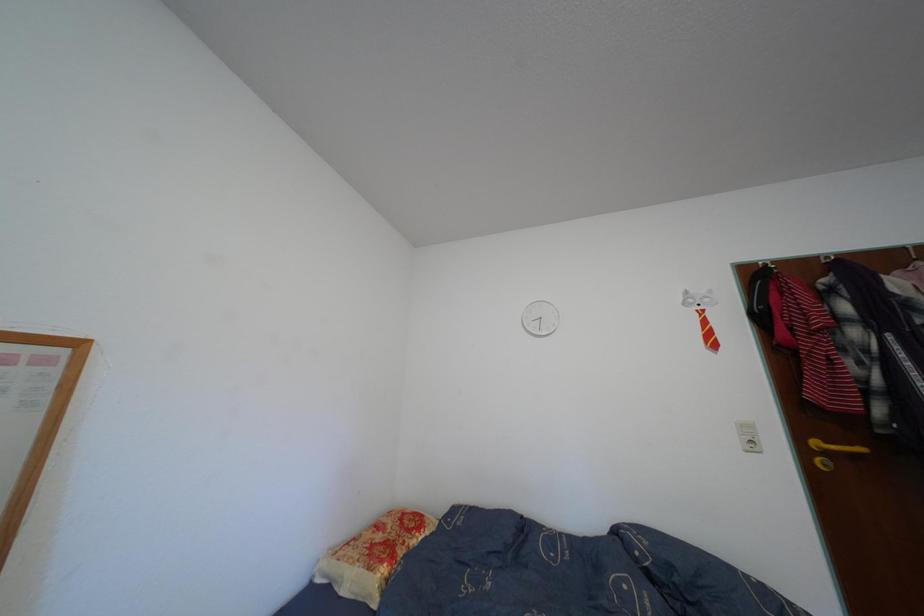
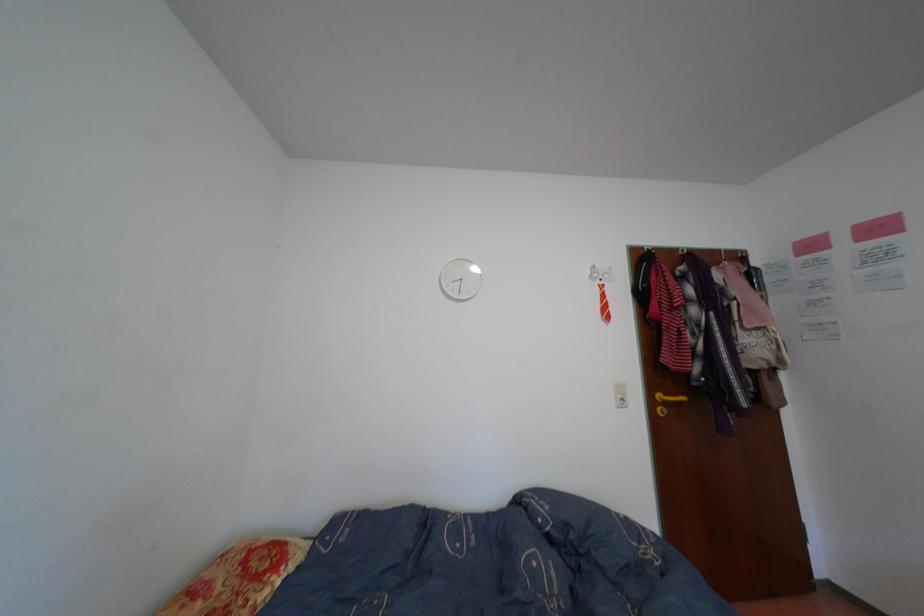
Question: How did the camera likely rotate?

Choices:
 (A) Left
 (B) Right
 (C) Up
 (D) Down

Answer: (B)